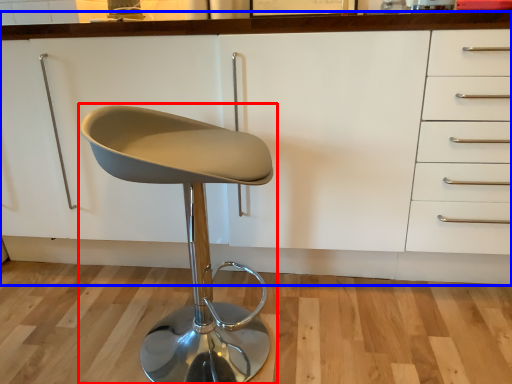
Question: Among these objects, which one is farthest to the camera, chair (highlighted by a red box) or cabinetry (highlighted by a blue box)?

Choices:
 (A) chair
 (B) cabinetry

Answer: (B)